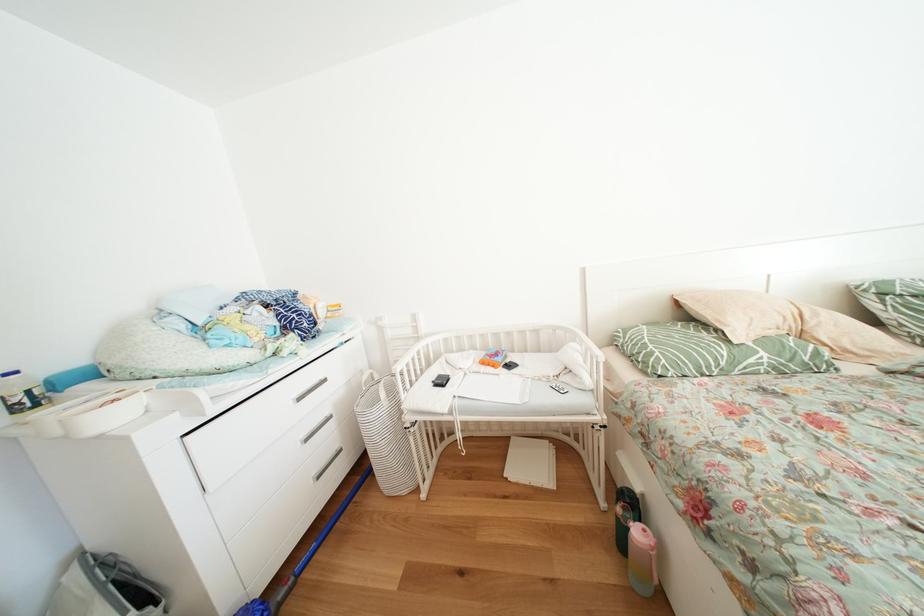
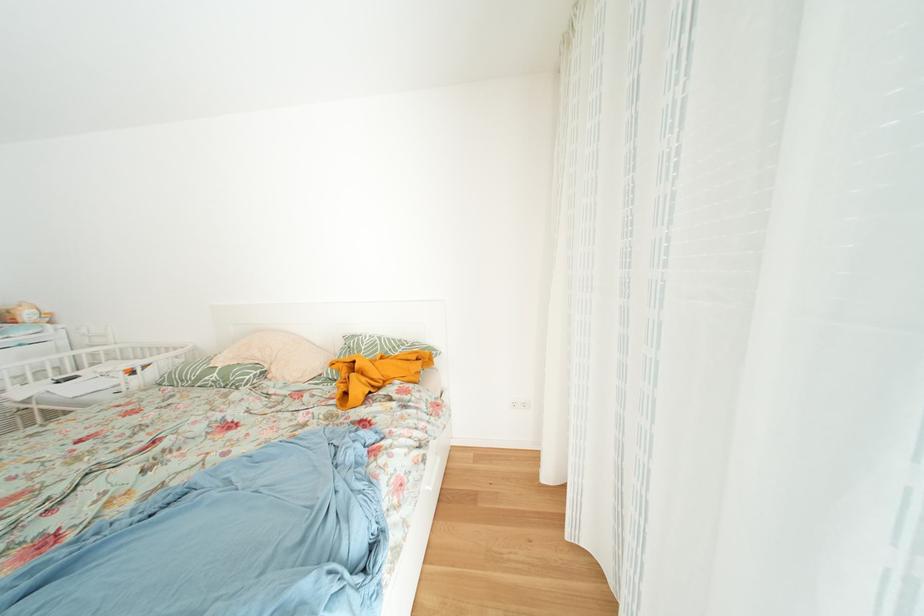
The point at (743, 369) is marked in the first image. Where is the corresponding point in the second image?

(208, 384)